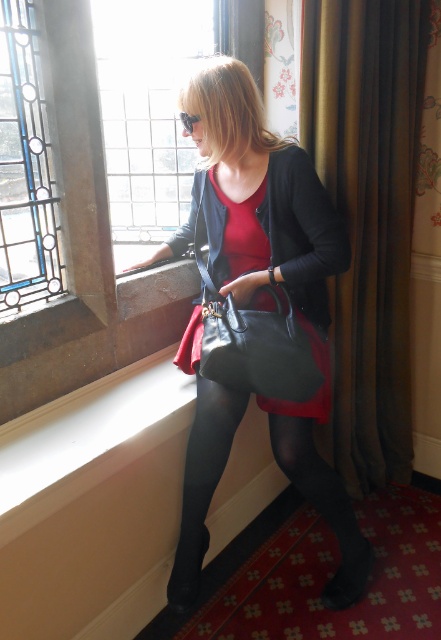
Does brown velvet curtain at right have a lesser width compared to black tights at lower center?

Yes, brown velvet curtain at right is thinner than black tights at lower center.

Identify the location of brown velvet curtain at right. (367, 216).

Who is more forward, (403, 12) or (336, 529)?

Positioned in front is point (336, 529).

Find the location of `brown velvet curtain at right`. brown velvet curtain at right is located at coordinates (367, 216).

Is matte black dress at center closer to camera compared to black leather handbag at center?

That is False.

Between point (298, 280) and point (261, 320), which one is positioned behind?

Point (298, 280)

Is point (296, 243) more distant than point (208, 289)?

No, (296, 243) is closer to viewer.

You are a GUI agent. You are given a task and a screenshot of the screen. Output one action in this format:
    pyautogui.click(x=<x>, y=<y>)
    Task: Click on the matte black dress at center
    
    Given the screenshot: What is the action you would take?
    pyautogui.click(x=302, y=230)

Between matte black handbag at center and matte black dress at center, which one has more height?

matte black handbag at center

Does matte black handbag at center have a larger size compared to matte black dress at center?

Yes.

Which is in front, point (265, 200) or point (190, 212)?

Positioned in front is point (265, 200).

The height and width of the screenshot is (640, 441). What are the coordinates of `matte black handbag at center` in the screenshot? It's located at (276, 275).